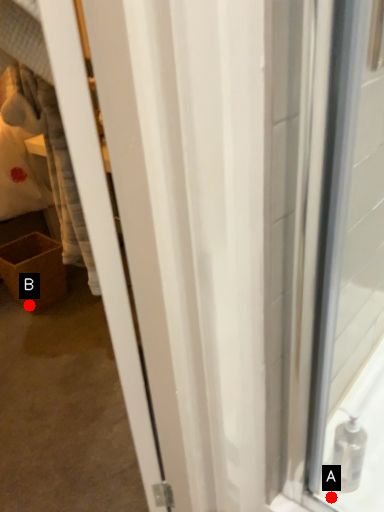
Question: Two points are circled on the image, labeled by A and B beside each circle. Which point is further to the camera?

Choices:
 (A) A is further
 (B) B is further

Answer: (B)